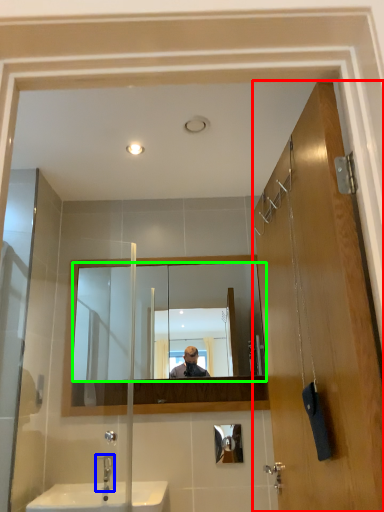
Question: Estimate the real-world distances between objects in this image. Which object is farther from door (highlighted by a red box), tap (highlighted by a blue box) or mirror (highlighted by a green box)?

Choices:
 (A) tap
 (B) mirror

Answer: (A)